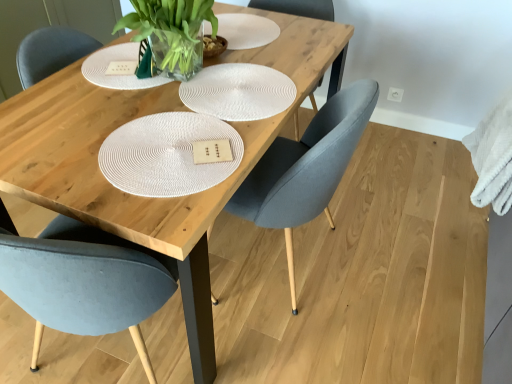
Question: Is point (103, 198) closer or farther from the camera than point (493, 208)?

Choices:
 (A) closer
 (B) farther

Answer: (A)

Question: From a real-world perspective, is wooden table at center positioned above or below white fluffy towel at right?

Choices:
 (A) below
 (B) above

Answer: (A)

Question: Which object is the closest to the white fluffy towel at right?

Choices:
 (A) wooden table at center
 (B) white woven placemat at center
 (C) matte gray chair at center, which is counted as the 1th chair, starting from the right
 (D) matte gray chair at center, marked as the 2th chair in a right-to-left arrangement

Answer: (C)

Question: Which of these objects is positioned farthest from the wooden table at center?

Choices:
 (A) white woven placemat at center
 (B) matte gray chair at center, which appears as the 2th chair when viewed from the left
 (C) matte gray chair at center, which ranks as the 1th chair in left-to-right order
 (D) white fluffy towel at right

Answer: (D)